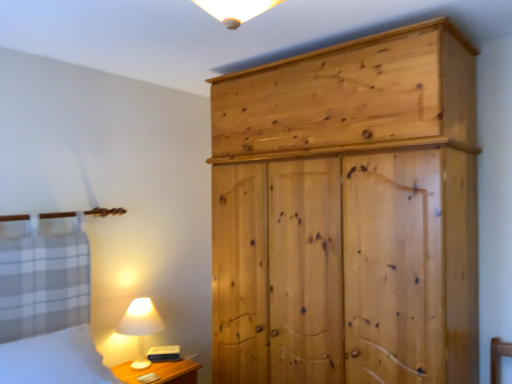
Question: Would you say natural wood wardrobe at right is to the left or to the right of wooden nightstand at lower left in the picture?

Choices:
 (A) right
 (B) left

Answer: (A)

Question: Is natural wood wardrobe at right in front of or behind wooden nightstand at lower left in the image?

Choices:
 (A) front
 (B) behind

Answer: (A)

Question: Which of these objects is positioned farthest from the wooden nightstand at lower left?

Choices:
 (A) white matte table lamp at lower left
 (B) natural wood wardrobe at right
 (C) white cotton bed at lower left

Answer: (B)

Question: Estimate the real-world distances between objects in this image. Which object is closer to the white cotton bed at lower left?

Choices:
 (A) wooden nightstand at lower left
 (B) natural wood wardrobe at right
 (C) white matte table lamp at lower left

Answer: (C)